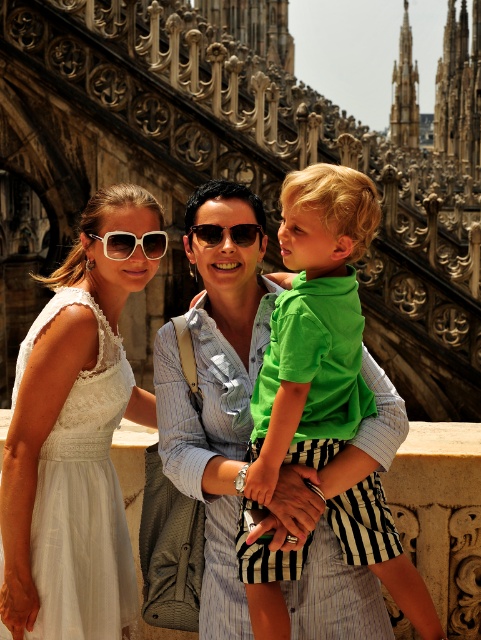
Is the position of green matte shirt at center less distant than that of white plastic sunglasses at upper center?

Yes, it is in front of white plastic sunglasses at upper center.

What do you see at coordinates (314, 326) in the screenshot?
I see `green matte shirt at center` at bounding box center [314, 326].

You are a GUI agent. You are given a task and a screenshot of the screen. Output one action in this format:
    pyautogui.click(x=<x>, y=<y>)
    Task: Click on the green matte shirt at center
    The height and width of the screenshot is (640, 481).
    Given the screenshot: What is the action you would take?
    pyautogui.click(x=314, y=326)

Does white lace dress at center have a lesser height compared to white plastic sunglasses at upper center?

In fact, white lace dress at center may be taller than white plastic sunglasses at upper center.

Can you confirm if white lace dress at center is positioned to the right of white plastic sunglasses at upper center?

No, white lace dress at center is not to the right of white plastic sunglasses at upper center.

In order to click on white lace dress at center in this screenshot , I will do `click(75, 442)`.

Does green matte shirt at center appear on the left side of sunglasses at center?

No, green matte shirt at center is not to the left of sunglasses at center.

Between green matte shirt at center and sunglasses at center, which one appears on the right side from the viewer's perspective?

green matte shirt at center

Where is `green matte shirt at center`? The height and width of the screenshot is (640, 481). green matte shirt at center is located at coordinates (314, 326).